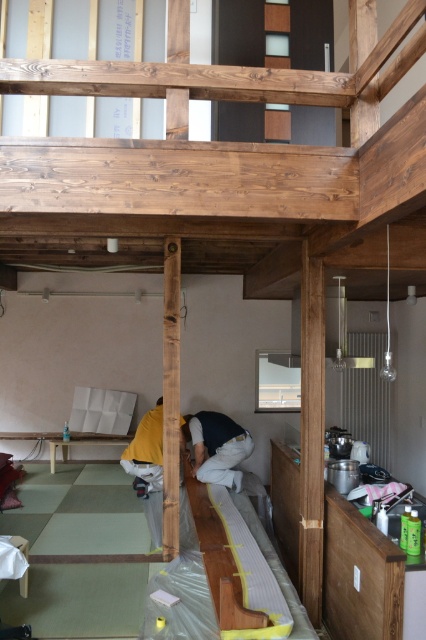
Can you confirm if wooden bed at lower center is smaller than yellow fabric at lower center?

Actually, wooden bed at lower center might be larger than yellow fabric at lower center.

Can you confirm if wooden bed at lower center is taller than yellow fabric at lower center?

Incorrect, wooden bed at lower center's height is not larger of yellow fabric at lower center's.

At what (x,y) coordinates should I click in order to perform the action: click on wooden bed at lower center. Please return your answer as a coordinate pair (x, y). Image resolution: width=426 pixels, height=640 pixels. Looking at the image, I should click on (236, 566).

Identify the location of smooth wood beam at center. (170, 396).

Is smooth wood beam at center in front of yellow fabric at lower center?

Yes, smooth wood beam at center is closer to the viewer.

Is point (164, 461) positioned in front of point (134, 440)?

Yes, point (164, 461) is in front of point (134, 440).

Identify the location of smooth wood beam at center. (170, 396).

Between wooden bed at lower center and dark blue fabric at center, which one appears on the right side from the viewer's perspective?

wooden bed at lower center

Is wooden bed at lower center below dark blue fabric at center?

Correct, wooden bed at lower center is located below dark blue fabric at center.

Is point (187, 499) closer to viewer compared to point (239, 436)?

Yes, it is in front of point (239, 436).

Where is `wooden bed at lower center`? This screenshot has height=640, width=426. wooden bed at lower center is located at coordinates (236, 566).